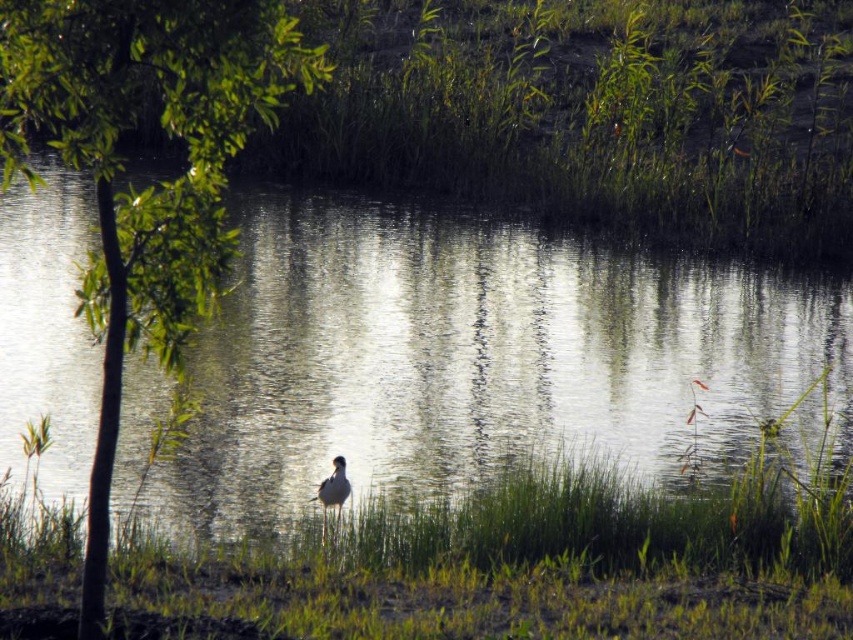
Question: Observing the image, what is the correct spatial positioning of green grass at center in reference to green leafy tree at center?

Choices:
 (A) below
 (B) above

Answer: (A)

Question: Based on their relative distances, which object is farther from the green leafy tree at center?

Choices:
 (A) green grass at center
 (B) clear water at center

Answer: (A)

Question: Can you confirm if green grass at center is positioned above white feathered bird at center?

Choices:
 (A) yes
 (B) no

Answer: (B)

Question: Does clear water at center appear over green leafy tree at center?

Choices:
 (A) no
 (B) yes

Answer: (A)

Question: Which of the following is the farthest from the observer?

Choices:
 (A) green leafy tree at center
 (B) white feathered bird at center
 (C) green grass at center
 (D) clear water at center

Answer: (D)

Question: Which point is closer to the camera?

Choices:
 (A) (325, 554)
 (B) (93, 278)

Answer: (B)